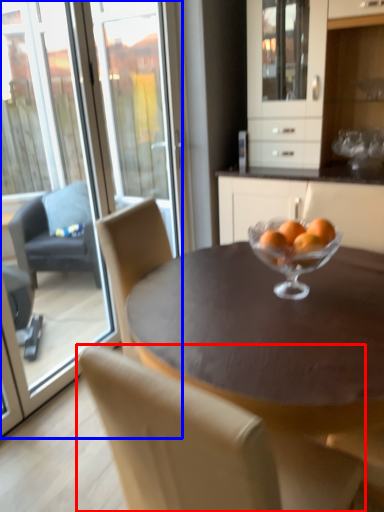
Question: Which point is closer to the camera, chair (highlighted by a red box) or screen door (highlighted by a blue box)?

Choices:
 (A) chair
 (B) screen door

Answer: (A)